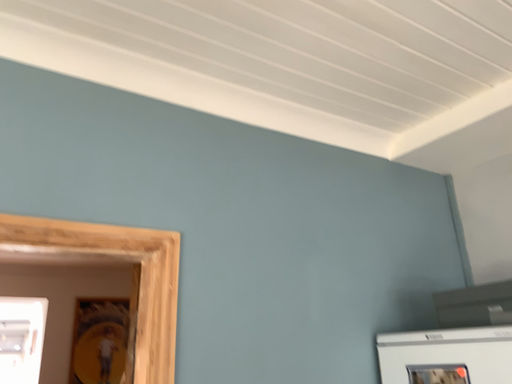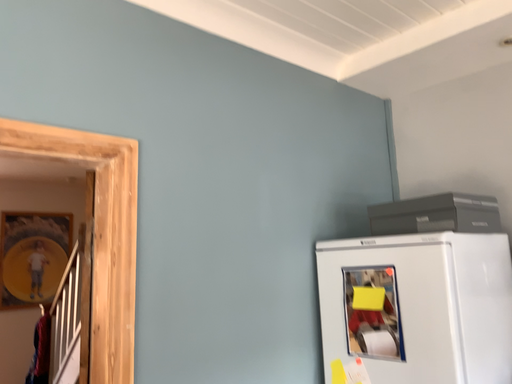
Question: Which way did the camera rotate in the video?

Choices:
 (A) rotated right
 (B) rotated left

Answer: (A)